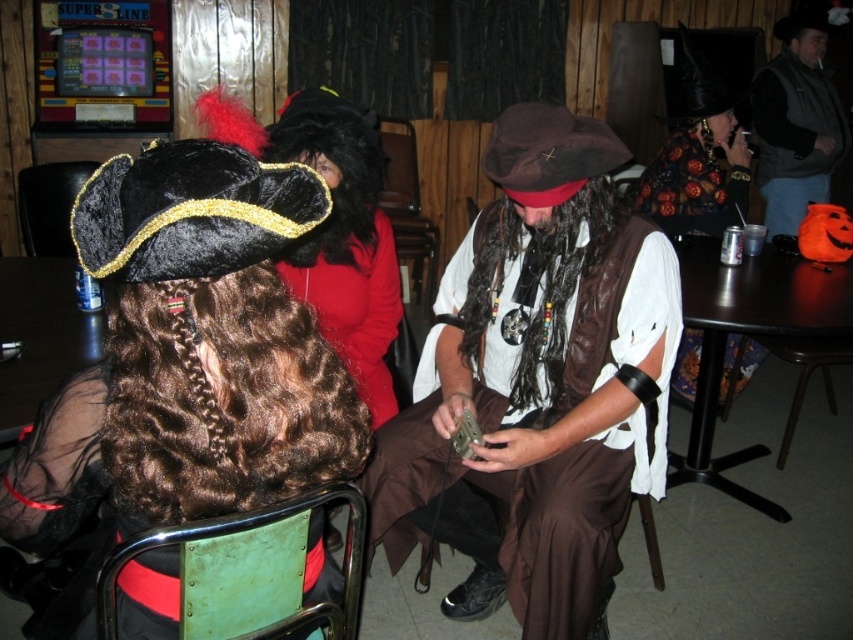
What object is located at the coordinates point (x=537, y=385) in the image?

The point (x=537, y=385) corresponds to the brown leather vest at center.

You are a costume designer observing the pirate costumes in the image. You need to determine which item is taller between the brown leather vest at center and the black curly wig at center. Which one is taller?

The brown leather vest at center is taller than the black curly wig at center.